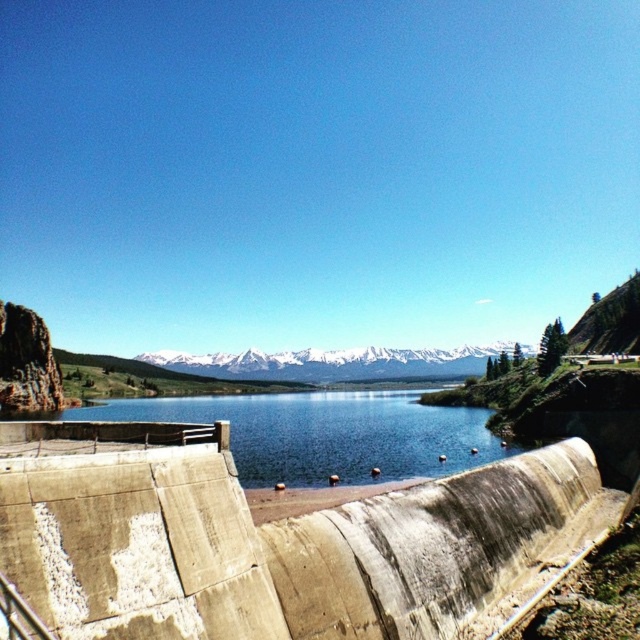
You are a construction worker tasked with reinforcing the dam. You need to know which structure is narrower between the concrete dam at lower center and the blue concrete water at center to determine where to allocate more materials. Which one is narrower?

The concrete dam at lower center is narrower than the blue concrete water at center, so more materials should be allocated there.